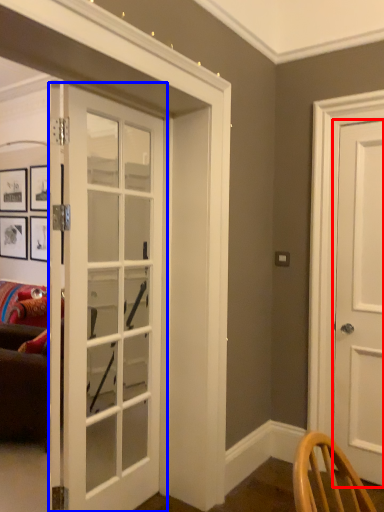
Question: Which object appears closest to the camera in this image, door (highlighted by a red box) or door (highlighted by a blue box)?

Choices:
 (A) door
 (B) door

Answer: (B)